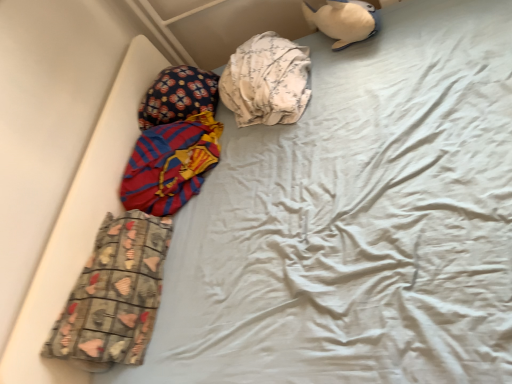
Question: Is point (256, 39) positioned closer to the camera than point (140, 177)?

Choices:
 (A) farther
 (B) closer

Answer: (A)

Question: Visually, is white floral fabric at center, positioned as the third material in bottom-to-top order, positioned to the left or to the right of red and blue striped fabric at left, the 2th material when ordered from top to bottom?

Choices:
 (A) left
 (B) right

Answer: (B)

Question: Estimate the real-world distances between objects in this image. Which object is closer to the red and blue striped fabric at left, which ranks as the 2th material in bottom-to-top order?

Choices:
 (A) white plush toy at upper right
 (B) white floral fabric at center, the 1th material in the top-to-bottom sequence
 (C) printed fabric pants at lower left, positioned as the 1th material in bottom-to-top order
 (D) fluffy fabric pillow at upper left

Answer: (D)

Question: Based on their relative distances, which object is nearer to the white floral fabric at center, positioned as the third material in bottom-to-top order?

Choices:
 (A) red and blue striped fabric at left, the 2th material when ordered from top to bottom
 (B) white plush toy at upper right
 (C) fluffy fabric pillow at upper left
 (D) printed fabric pants at lower left, positioned as the 1th material in bottom-to-top order

Answer: (C)